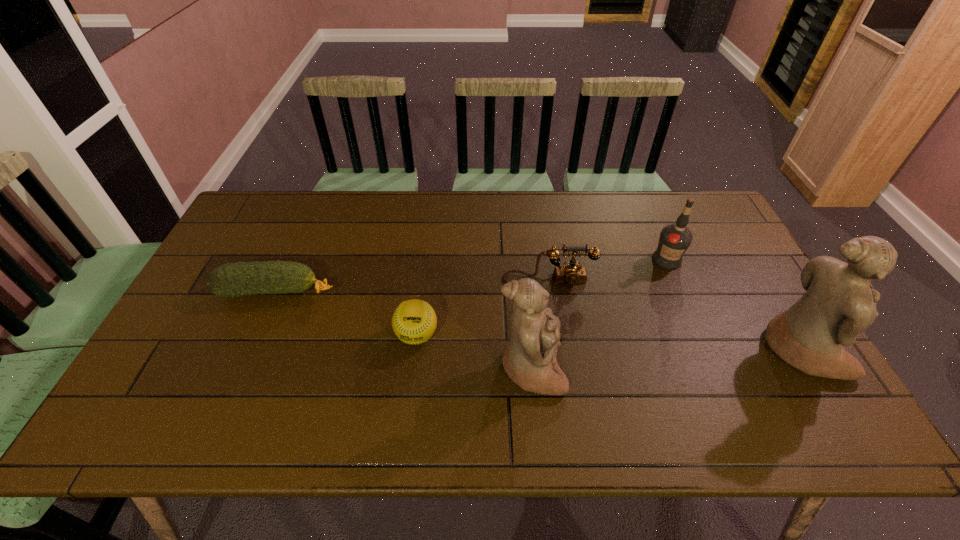
Observe the arrangement of all figurines in the image. To keep them evenly spaced, where would you place another figurine on the left? Please locate a free space. Please provide its 2D coordinates. Your answer should be formatted as a tuple, i.e. [(x, y)], where the tuple contains the x and y coordinates of a point satisfying the conditions above.

[(242, 389)]